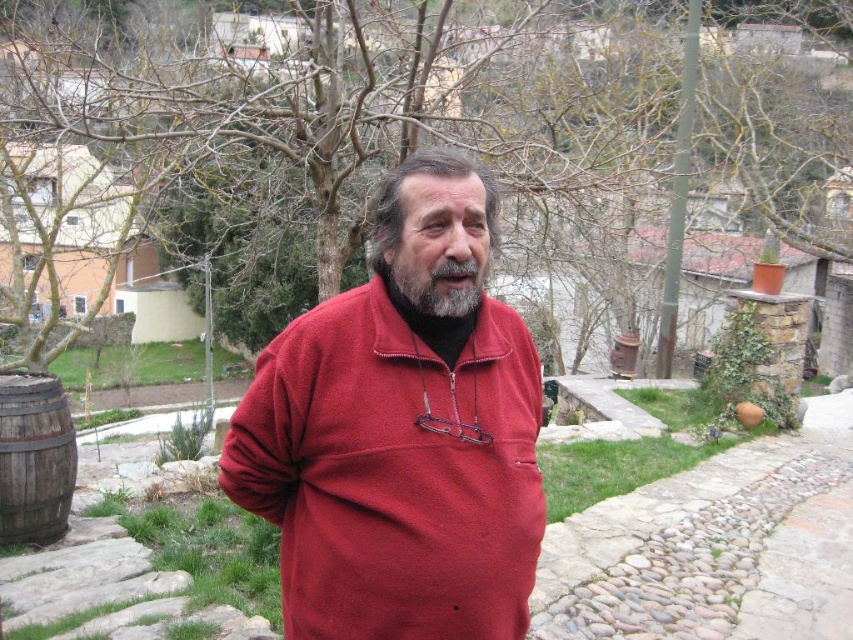
You are a painter who wants to sketch the scene. You have a canvas that can only fit objects up to the width of the matte fleece pullover at center. Will the bare branches at upper center fit on your canvas?

The bare branches at upper center might be wider than the matte fleece pullover at center, so they may not fit on the canvas if the canvas can only accommodate the width of the matte fleece pullover at center.

You are a photographer standing at a point 2.66 meters away from the camera. You want to take a photo of the man in the scene. Is the point at coordinates point (380,253) within your shooting range?

The distance of point (380,253) from camera is 2.66 meters, so yes, the point at coordinates point (380,253) is within your shooting range since it is exactly at 2.66 meters away from the camera.